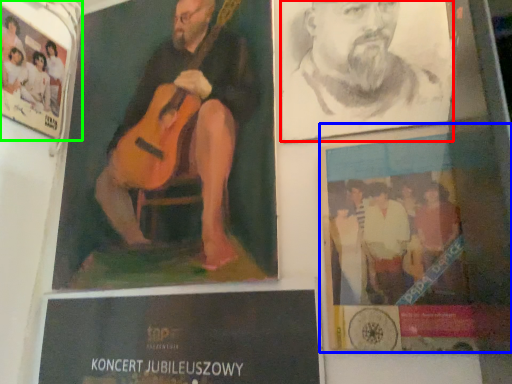
Question: Which object is positioned closest to man (highlighted by a red box)? Select from poster (highlighted by a blue box) and poster (highlighted by a green box).

Choices:
 (A) poster
 (B) poster

Answer: (A)